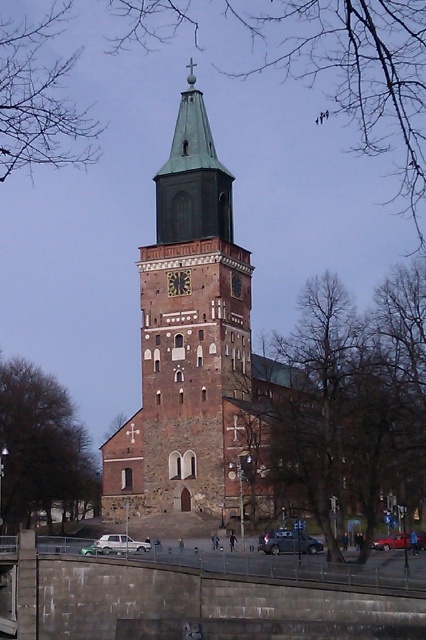
Question: Considering the real-world distances, which object is closest to the brown stone church at center?

Choices:
 (A) green copper bell tower at center
 (B) dark brown stone clock at center

Answer: (A)

Question: Which object is farther from the camera taking this photo?

Choices:
 (A) green copper bell tower at center
 (B) brown stone church at center

Answer: (A)

Question: Which point appears farthest from the camera in this image?

Choices:
 (A) (164, 189)
 (B) (212, 374)
 (C) (187, 291)

Answer: (A)

Question: Is green copper bell tower at center positioned before dark brown stone clock at center?

Choices:
 (A) yes
 (B) no

Answer: (A)

Question: Can you confirm if brown stone church at center is bigger than dark brown stone clock at center?

Choices:
 (A) no
 (B) yes

Answer: (B)

Question: Is brown stone church at center to the right of green copper bell tower at center from the viewer's perspective?

Choices:
 (A) yes
 (B) no

Answer: (A)